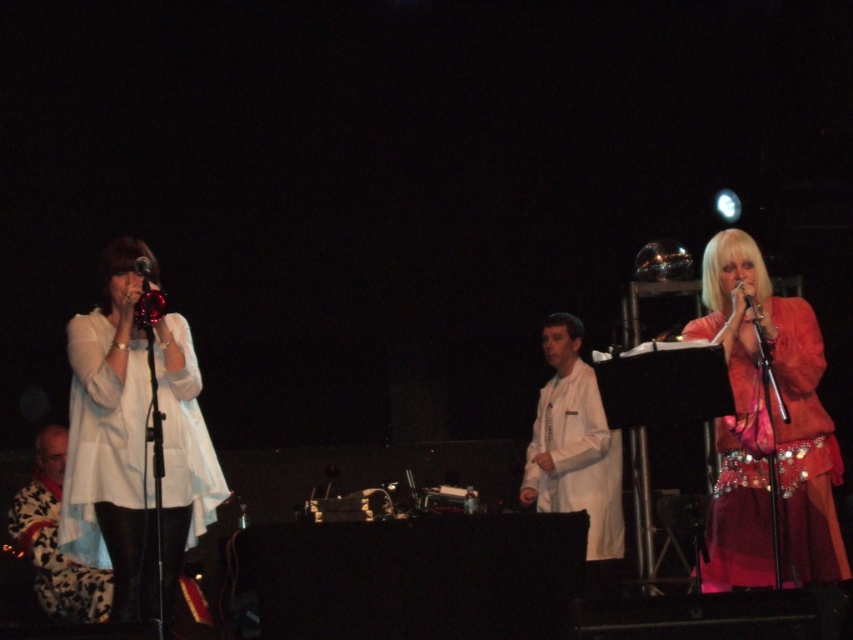
Question: Is white matte coat at center below metallic shiny microphone at left?

Choices:
 (A) yes
 (B) no

Answer: (A)

Question: Which object is the closest to the shiny red dress at right?

Choices:
 (A) white matte coat at center
 (B) white matte dress at left
 (C) floral-patterned coat at lower left

Answer: (A)

Question: Among these points, which one is nearest to the camera?

Choices:
 (A) (68, 531)
 (B) (16, 493)

Answer: (A)

Question: Is white matte dress at left to the right of shiny red dress at right from the viewer's perspective?

Choices:
 (A) yes
 (B) no

Answer: (B)

Question: Which object is positioned closest to the metallic shiny microphone at left?

Choices:
 (A) white matte dress at left
 (B) floral-patterned coat at lower left
 (C) shiny red dress at right

Answer: (A)

Question: Does shiny red dress at right appear on the left side of metallic shiny microphone at left?

Choices:
 (A) yes
 (B) no

Answer: (B)